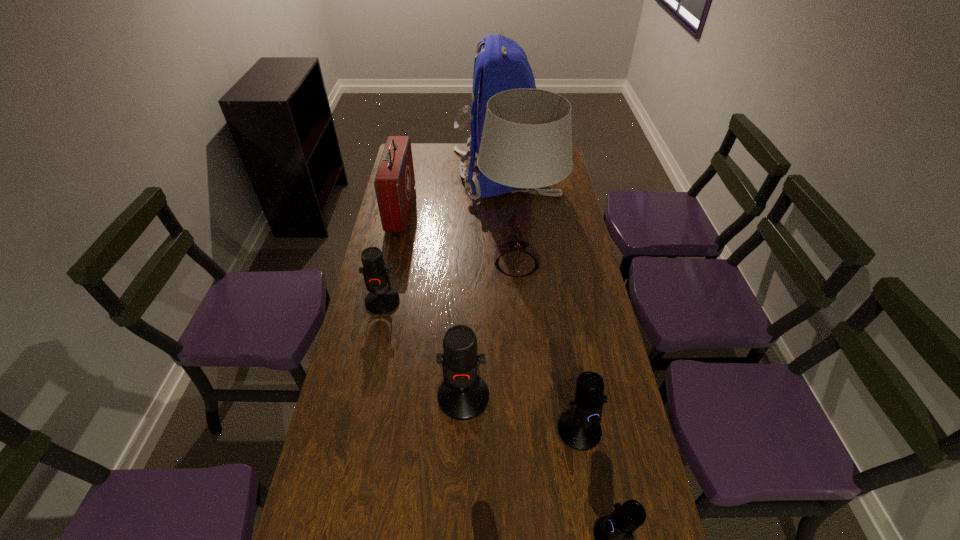
I want to click on blank space located 0.080m on the back of the blue backpack, so click(433, 175).

Image resolution: width=960 pixels, height=540 pixels. I want to click on vacant space positioned 0.080m on the front-facing side of the table lamp, so click(x=455, y=264).

At what (x,y) coordinates should I click in order to perform the action: click on vacant space situated 0.140m on the front-facing side of the table lamp. Please return your answer as a coordinate pair (x, y). Image resolution: width=960 pixels, height=540 pixels. Looking at the image, I should click on (439, 264).

Where is `free space located 0.050m on the front-facing side of the table lamp`? free space located 0.050m on the front-facing side of the table lamp is located at coordinates (464, 264).

The width and height of the screenshot is (960, 540). I want to click on vacant region located 0.110m on the side of the red first-aid kit with the first aid cross symbol, so click(x=438, y=209).

The image size is (960, 540). Find the location of `free spot located 0.240m on the side of the tallest microphone with the red ring`. free spot located 0.240m on the side of the tallest microphone with the red ring is located at coordinates (460, 520).

The height and width of the screenshot is (540, 960). I want to click on free location located on the stand of the bigger black microphone, so click(595, 525).

Find the location of a particular element. The height and width of the screenshot is (540, 960). vacant position located on the side of the smaller red microphone with the red ring is located at coordinates (367, 376).

The image size is (960, 540). I want to click on object at the far edge, so click(502, 65).

Where is `the first-aid kit located at the left edge`? the first-aid kit located at the left edge is located at coordinates (394, 183).